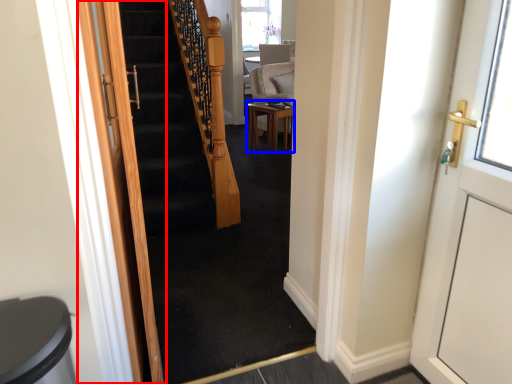
Question: Which of the following is the closest to the observer, door (highlighted by a red box) or table (highlighted by a blue box)?

Choices:
 (A) door
 (B) table

Answer: (A)